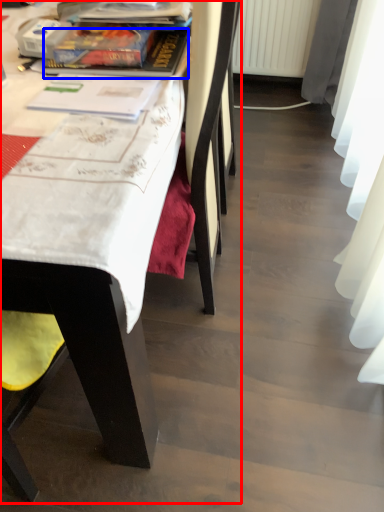
Question: Which point is closer to the camera, chair (highlighted by a red box) or book (highlighted by a blue box)?

Choices:
 (A) chair
 (B) book

Answer: (A)